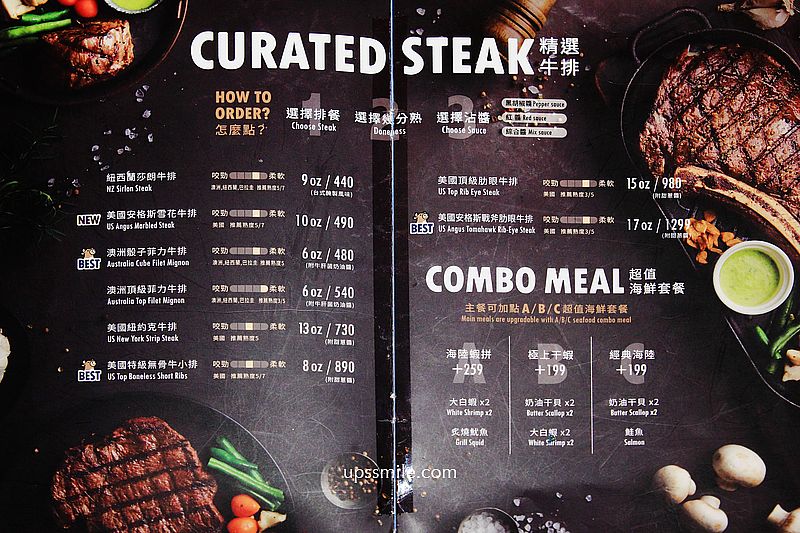
Find the location of a particular element. The width and height of the screenshot is (800, 533). pepper grinder is located at coordinates (520, 23).